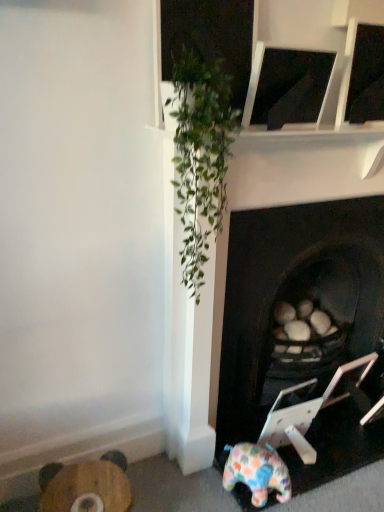
Find the location of `free spot above wooden stool at lower left (from a real-world perspective)`. free spot above wooden stool at lower left (from a real-world perspective) is located at coordinates (82, 485).